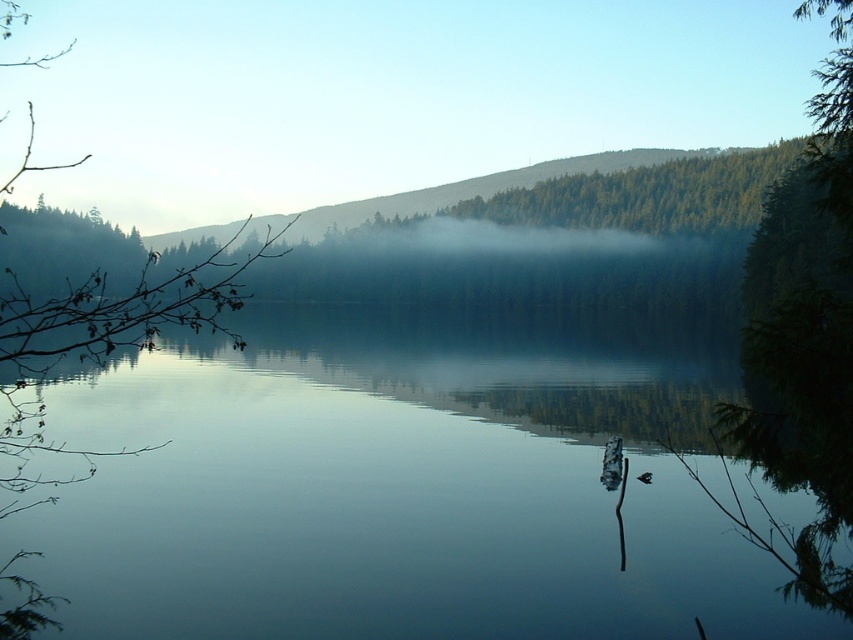
You are standing at the edge of the lake and want to place a small decorative stone between the transparent water at center and the green matte branch at left. If the stone is 0.5 meters in diameter, will there be enough space between them to place it without touching either object?

The transparent water at center is 59.69 meters away from the green matte branch at left. Since the stone is only 0.5 meters in diameter, there is more than enough space to place it between them without touching either object.

Looking at this image, you are standing at the edge of the lake and want to place a small floating decoration on the transparent water at center. Considering the green matte branch at left, will the decoration stay visible above the water surface?

The transparent water at center has a lesser height compared to green matte branch at left, meaning the water is shallower there. The decoration may not float high enough to stay visible above the water surface due to the lower water level.

You are an artist planning to paint this scene. You want to ensure the transparent water at center and the green matte branch at left are proportionally accurate. Which object should you paint first to maintain the correct size relationship between them?

Since the transparent water at center occupies less space than the green matte branch at left, you should paint the green matte branch at left first to establish its larger size before adding the smaller transparent water at center.